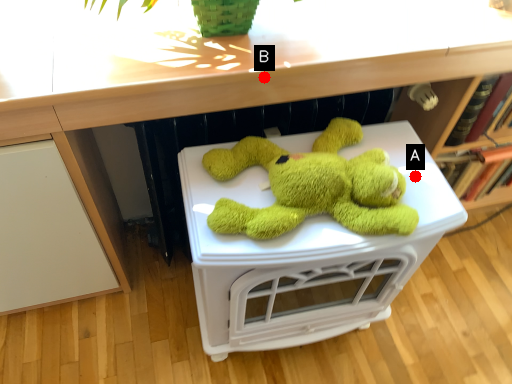
Question: Two points are circled on the image, labeled by A and B beside each circle. Which point is further to the camera?

Choices:
 (A) A is further
 (B) B is further

Answer: (A)